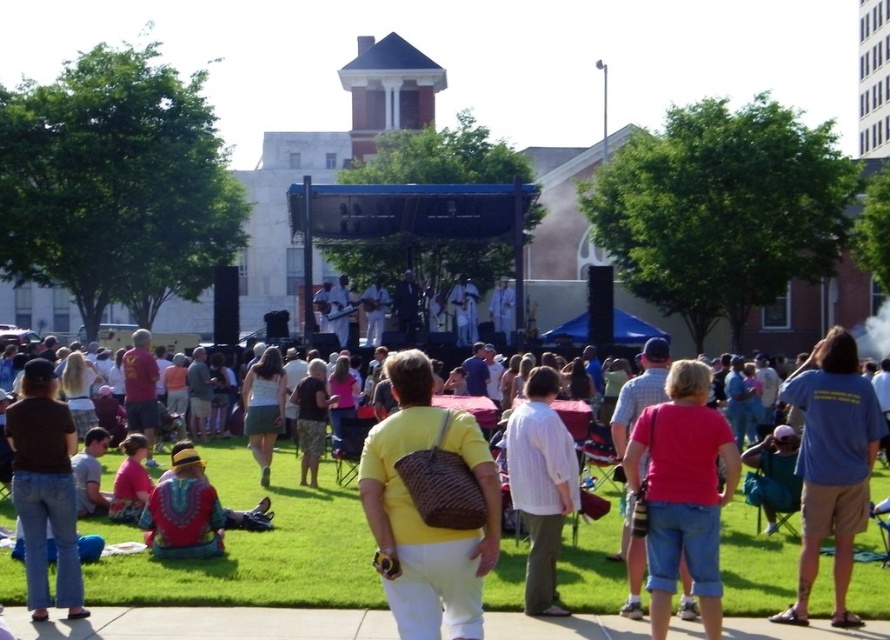
Who is lower down, white striped shirt at center or matte green skirt at center?

matte green skirt at center is below.

The height and width of the screenshot is (640, 890). Describe the element at coordinates (541, 484) in the screenshot. I see `white striped shirt at center` at that location.

This screenshot has width=890, height=640. Identify the location of white striped shirt at center. (541, 484).

Between blue cotton shirt at right and brown denim jeans at lower left, which one has less height?

brown denim jeans at lower left

Does blue cotton shirt at right have a greater width compared to brown denim jeans at lower left?

Yes.

The image size is (890, 640). Identify the location of blue cotton shirt at right. (832, 465).

Which is in front, point (804, 534) or point (541, 604)?

Point (541, 604) is in front.

Measure the distance between point (839, 406) and camera.

They are 46.57 meters apart.

The width and height of the screenshot is (890, 640). Describe the element at coordinates (832, 465) in the screenshot. I see `blue cotton shirt at right` at that location.

Identify the location of blue cotton shirt at right. click(x=832, y=465).